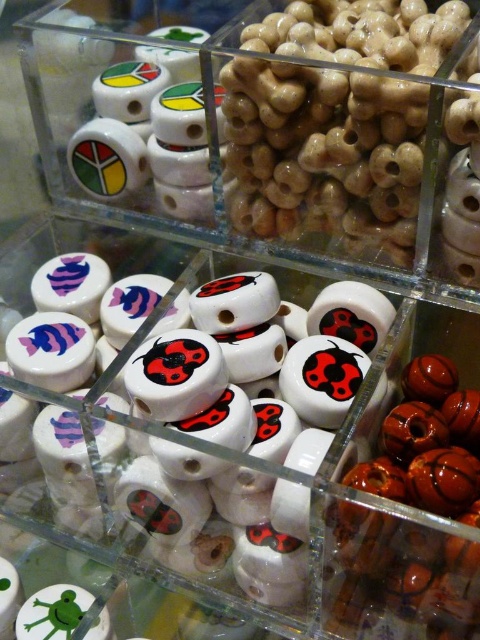
Question: Among these points, which one is farthest from the camera?

Choices:
 (A) (377, 454)
 (B) (266, 436)

Answer: (A)

Question: Which point is farther from the camera taking this photo?

Choices:
 (A) (187, 449)
 (B) (264, 435)

Answer: (B)

Question: From the image, what is the correct spatial relationship of white glossy beads at center in relation to white glossy bead at center?

Choices:
 (A) left
 (B) right

Answer: (A)

Question: Can you confirm if white glossy beads at center is positioned to the right of white glossy bead at center?

Choices:
 (A) yes
 (B) no

Answer: (B)

Question: Can you confirm if white glossy beads at center is wider than white glossy bead at center?

Choices:
 (A) no
 (B) yes

Answer: (B)